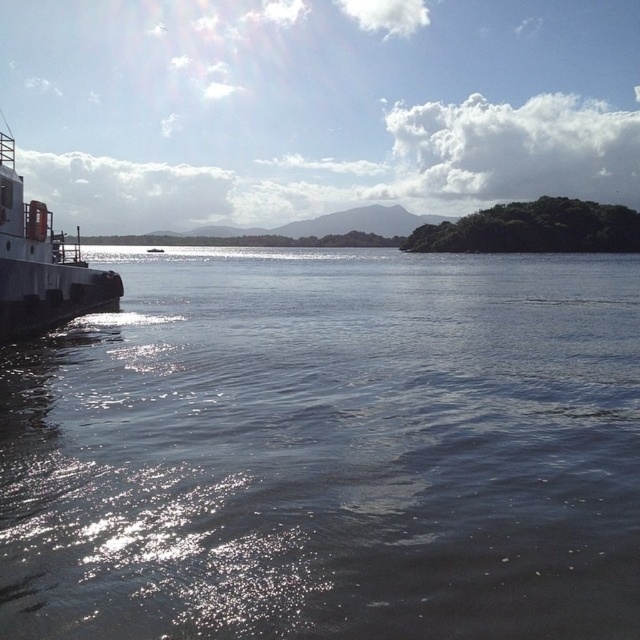
Question: Which object is farther from the camera taking this photo?

Choices:
 (A) dark blue water at lower left
 (B) metallic gray boat at left

Answer: (B)

Question: Does dark blue water at lower left come behind metallic gray boat at left?

Choices:
 (A) yes
 (B) no

Answer: (B)

Question: Does dark blue water at lower left appear under metallic gray boat at left?

Choices:
 (A) no
 (B) yes

Answer: (B)

Question: Is dark blue water at lower left below metallic gray boat at left?

Choices:
 (A) yes
 (B) no

Answer: (A)

Question: Which point appears farthest from the camera in this image?

Choices:
 (A) (36, 252)
 (B) (112, 330)

Answer: (B)